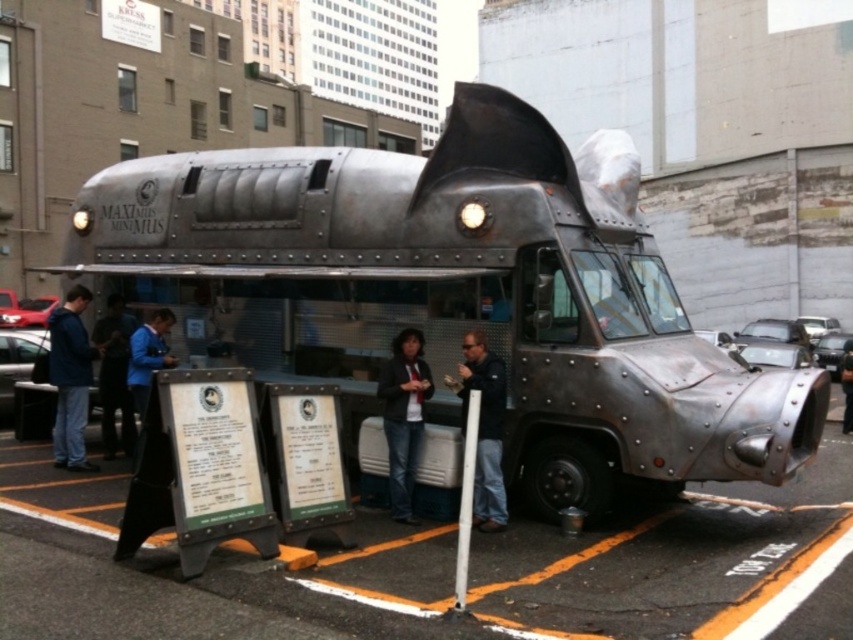
Question: Among these points, which one is nearest to the camera?

Choices:
 (A) (473, 355)
 (B) (57, 344)
 (C) (457, 534)
 (D) (845, 380)

Answer: (C)

Question: Considering the real-world distances, which object is closest to the metallic helmet at center?

Choices:
 (A) blue denim jacket at left
 (B) white plastic pole at lower center

Answer: (B)

Question: Which point appears farthest from the camera in this image?

Choices:
 (A) (502, 381)
 (B) (132, 348)

Answer: (B)

Question: Is the position of blue denim jacket at left more distant than that of blue fabric jacket at center?

Choices:
 (A) yes
 (B) no

Answer: (B)

Question: Can you confirm if blue fabric jacket at center is smaller than metallic helmet at center?

Choices:
 (A) yes
 (B) no

Answer: (A)

Question: Can you confirm if blue fabric jacket at center is positioned above metallic helmet at center?

Choices:
 (A) no
 (B) yes

Answer: (B)